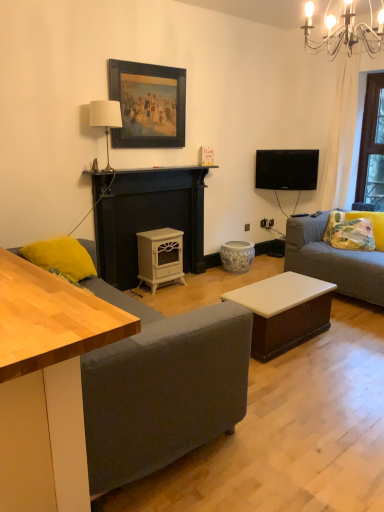
Find the location of a particular element. The image size is (384, 512). vacant location below white glossy wood stove at center (from a real-world perspective) is located at coordinates (173, 286).